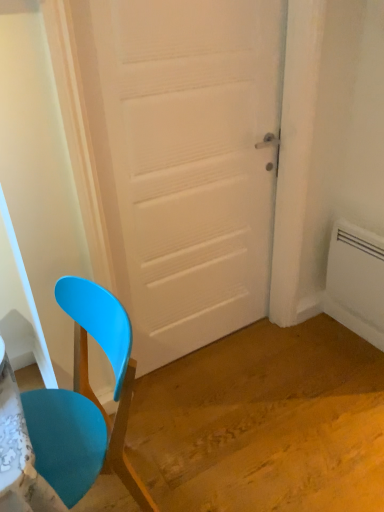
Consider the image. Measure the distance between point (379, 255) and camera.

Point (379, 255) and camera are 1.76 meters apart from each other.

At what (x,y) coordinates should I click in order to perform the action: click on white matte door at center. Please return your answer as a coordinate pair (x, y). The image size is (384, 512). Looking at the image, I should click on (188, 163).

This screenshot has height=512, width=384. Find the location of `matte plastic chair at left`. matte plastic chair at left is located at coordinates (86, 401).

Where is `white plastic radiator at right`? white plastic radiator at right is located at coordinates (356, 281).

Between matte plastic chair at left and white plastic radiator at right, which one has smaller width?

Thinner between the two is white plastic radiator at right.

Based on the photo, from the image's perspective, is matte plastic chair at left above or below white plastic radiator at right?

matte plastic chair at left is situated lower than white plastic radiator at right in the image.

Considering the relative sizes of matte plastic chair at left and white plastic radiator at right in the image provided, is matte plastic chair at left smaller than white plastic radiator at right?

No, matte plastic chair at left is not smaller than white plastic radiator at right.

How different are the orientations of matte plastic chair at left and white plastic radiator at right in degrees?

matte plastic chair at left and white plastic radiator at right are facing 0.39 degrees away from each other.

Can you confirm if white plastic radiator at right is smaller than white matte door at center?

Yes, white plastic radiator at right is smaller than white matte door at center.

Locate an element on the screen. The width and height of the screenshot is (384, 512). radiator below the white matte door at center (from a real-world perspective) is located at coordinates (356, 281).

Is white plastic radiator at right to the left or to the right of white matte door at center in the image?

Based on their positions, white plastic radiator at right is located to the right of white matte door at center.

How far apart are white matte door at center and matte plastic chair at left?

white matte door at center is 24.82 inches from matte plastic chair at left.

From a real-world perspective, is white matte door at center physically below matte plastic chair at left?

No, from a real-world perspective, white matte door at center is not beneath matte plastic chair at left.

Does point (206, 280) come in front of point (82, 416)?

No, it is behind (82, 416).

Is white matte door at center not inside matte plastic chair at left?

white matte door at center lies outside matte plastic chair at left's area.

From a real-world perspective, is matte plastic chair at left on top of white matte door at center?

No, from a real-world perspective, matte plastic chair at left is not over white matte door at center

Is matte plastic chair at left located outside white matte door at center?

That's correct, matte plastic chair at left is outside of white matte door at center.

Find the location of a particular element. chair lying on the left of white matte door at center is located at coordinates (86, 401).

In the scene shown: Are matte plastic chair at left and white matte door at center located far from each other?

No, matte plastic chair at left is in close proximity to white matte door at center.

Locate an element on the screen. This screenshot has height=512, width=384. radiator to the right of matte plastic chair at left is located at coordinates (356, 281).

Is white plastic radiator at right aimed at matte plastic chair at left?

Yes, white plastic radiator at right faces towards matte plastic chair at left.

In terms of height, does white plastic radiator at right look taller or shorter compared to matte plastic chair at left?

In the image, white plastic radiator at right appears to be shorter than matte plastic chair at left.

From a real-world perspective, which is physically above, white plastic radiator at right or matte plastic chair at left?

From a 3D spatial view, matte plastic chair at left is above.

Find the location of a particular element. Image resolution: width=384 pixels, height=512 pixels. radiator behind the white matte door at center is located at coordinates (356, 281).

Is white plastic radiator at right a part of white matte door at center?

No, white plastic radiator at right is not a part of white matte door at center.

Can you confirm if white matte door at center is bigger than white plastic radiator at right?

Correct, white matte door at center is larger in size than white plastic radiator at right.

Could you tell me if white matte door at center is facing white plastic radiator at right?

No, white matte door at center is not oriented towards white plastic radiator at right.

The image size is (384, 512). Identify the location of radiator above the matte plastic chair at left (from the image's perspective). (356, 281).

Where is `radiator that appears behind the white matte door at center`? This screenshot has height=512, width=384. radiator that appears behind the white matte door at center is located at coordinates [356, 281].

Which object lies further to the anchor point white plastic radiator at right, matte plastic chair at left or white matte door at center?

matte plastic chair at left is positioned further to the anchor white plastic radiator at right.

From the image, which object appears to be farther from matte plastic chair at left, white plastic radiator at right or white matte door at center?

white plastic radiator at right is further to matte plastic chair at left.

From the image, which object appears to be nearer to white matte door at center, matte plastic chair at left or white plastic radiator at right?

matte plastic chair at left is positioned closer to the anchor white matte door at center.

Considering their positions, is white matte door at center positioned closer to white plastic radiator at right than matte plastic chair at left?

Based on the image, white matte door at center appears to be nearer to white plastic radiator at right.

From the image, which object appears to be nearer to white matte door at center, white plastic radiator at right or matte plastic chair at left?

The object closer to white matte door at center is matte plastic chair at left.

When comparing their distances from matte plastic chair at left, does white matte door at center or white plastic radiator at right seem further?

white plastic radiator at right is positioned further to the anchor matte plastic chair at left.

Find the location of a particular element. The height and width of the screenshot is (512, 384). door between matte plastic chair at left and white plastic radiator at right in the horizontal direction is located at coordinates (188, 163).